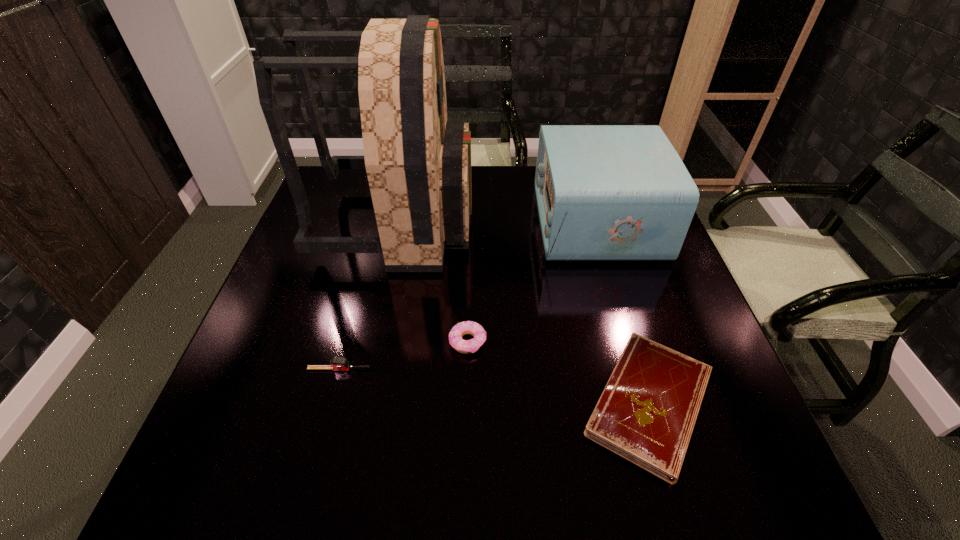
Where is `vacant region that satisfies the following two spatial constraints: 1. on the front face of the backpack; 2. on the back side of the shortest object`? vacant region that satisfies the following two spatial constraints: 1. on the front face of the backpack; 2. on the back side of the shortest object is located at coordinates (359, 403).

Where is `free space in the image that satisfies the following two spatial constraints: 1. on the front side of the shortest object; 2. on the left side of the doughnut`? This screenshot has width=960, height=540. free space in the image that satisfies the following two spatial constraints: 1. on the front side of the shortest object; 2. on the left side of the doughnut is located at coordinates (467, 403).